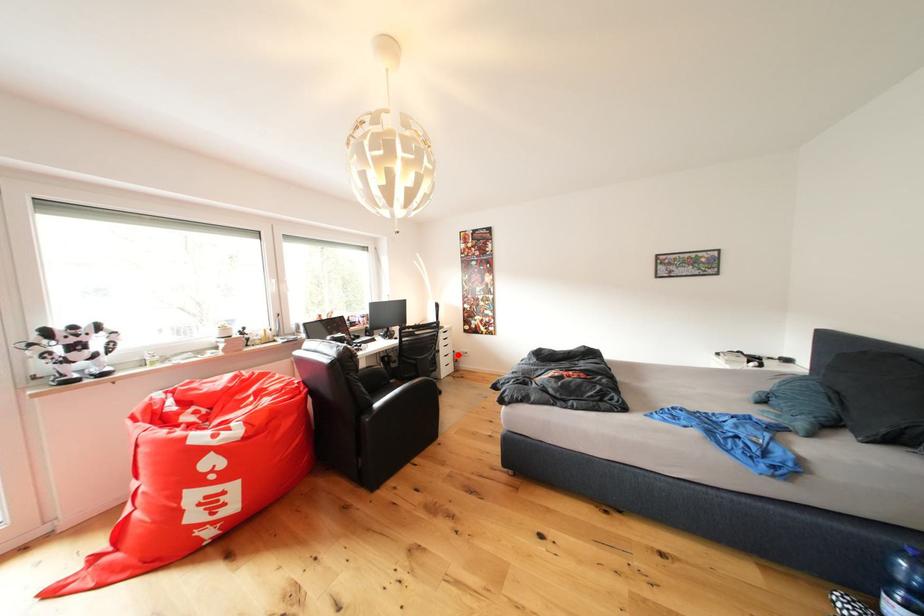
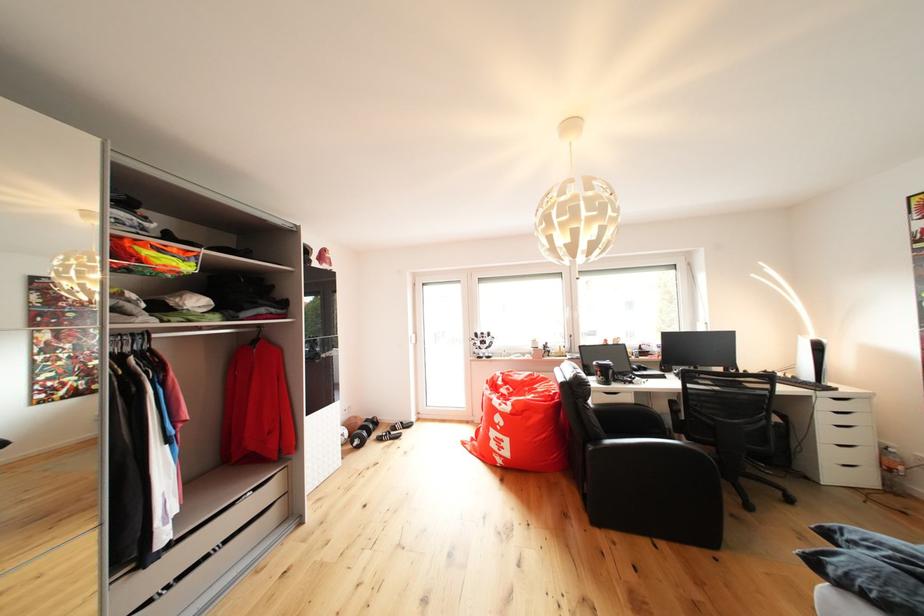
Question: I am providing you with two images of the same scene from different viewpoints. In image1, a red point is highlighted. Considering the same 3D point in image2, which of the following is correct?

Choices:
 (A) It is closer
 (B) It is farther

Answer: (B)